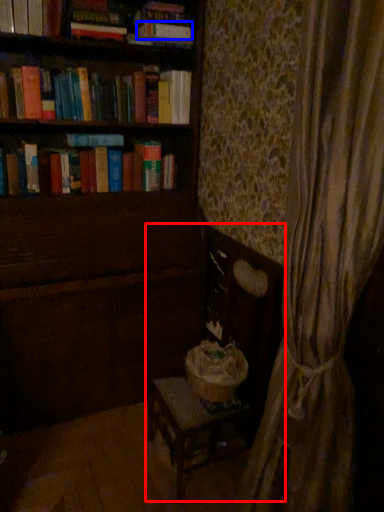
Question: Which object is closer to the camera taking this photo, rocking chair (highlighted by a red box) or paperback book (highlighted by a blue box)?

Choices:
 (A) rocking chair
 (B) paperback book

Answer: (A)